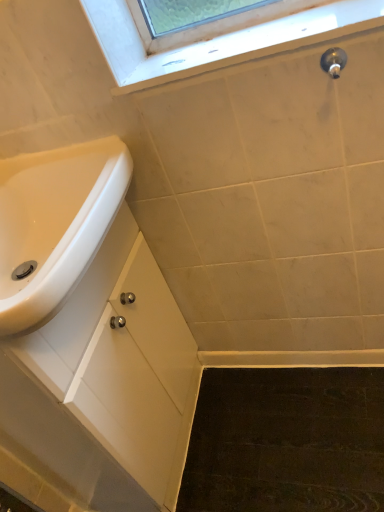
Locate an element on the screen. This screenshot has height=512, width=384. vacant region above clear glass window at upper center (from a real-world perspective) is located at coordinates (245, 33).